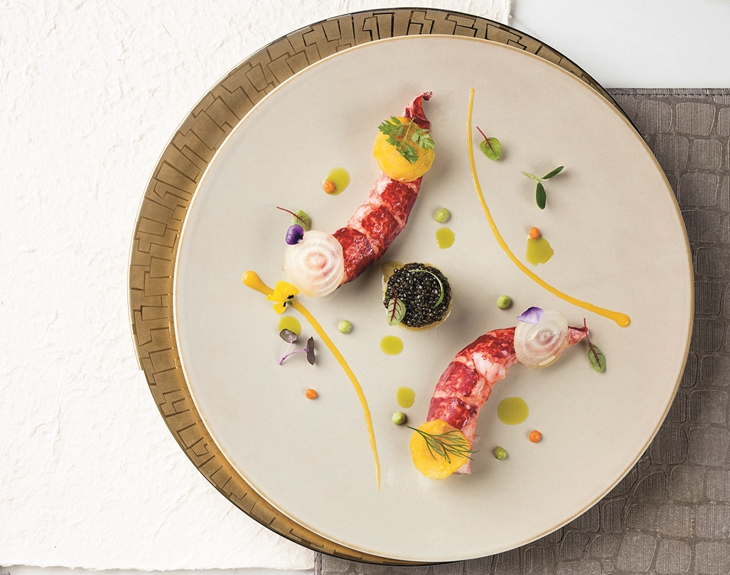
I want to click on plate, so click(283, 134).